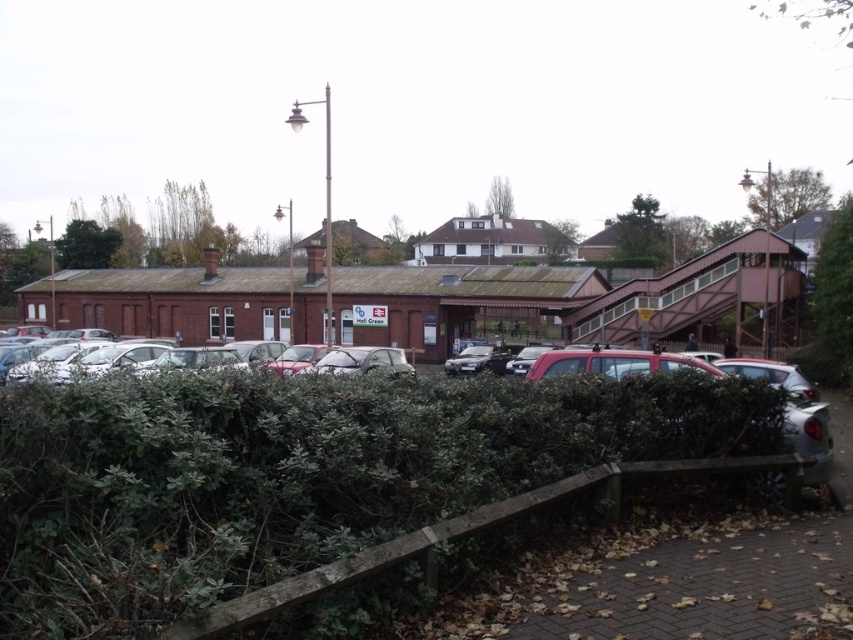
You are standing at the entrance of Hall Green station and want to find the green leafy hedge at lower left. According to the coordinates provided, where should you look relative to your current position?

The green leafy hedge at lower left is located at coordinates point (294,474), which means it is positioned to the lower left relative to your current position at the entrance of Hall Green station.

You are standing at the Hall Green station and want to take a photo of the station building. You notice two points marked in the scene. One is at coordinate point (202, 449) and the other at point (502, 371). Which point is better to focus on to ensure the station building is sharp in your photo?

Point (202, 449) is closer to the camera than point (502, 371), so focusing on point (202, 449) will ensure the station building is sharp in your photo.